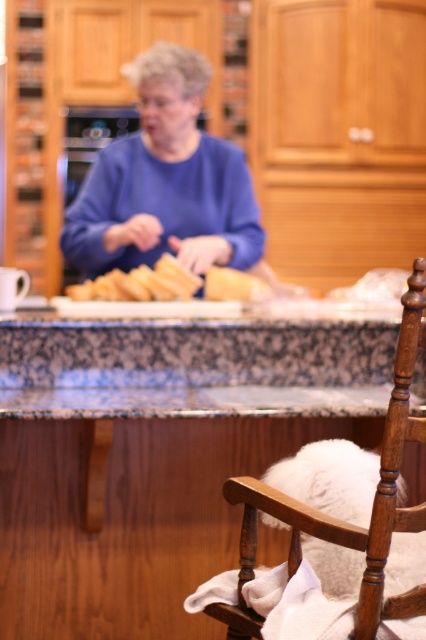
From the picture: Who is more forward, (186, 120) or (170, 260)?

Positioned in front is point (170, 260).

Who is more distant from viewer, (144, 109) or (120, 298)?

Positioned behind is point (144, 109).

Find the location of a particular element. blue matte sweater at center is located at coordinates (166, 180).

Between wooden rocking chair at lower right and golden brown bread at center, which one has more height?

Standing taller between the two is wooden rocking chair at lower right.

Between wooden rocking chair at lower right and golden brown bread at center, which one has less height?

golden brown bread at center

This screenshot has width=426, height=640. I want to click on wooden rocking chair at lower right, so (x=339, y=520).

Is blue matte sweater at center in front of wooden rocking chair at lower right?

No, blue matte sweater at center is behind wooden rocking chair at lower right.

Can you confirm if blue matte sweater at center is shorter than wooden rocking chair at lower right?

No.

Where is `blue matte sweater at center`? This screenshot has width=426, height=640. blue matte sweater at center is located at coordinates (166, 180).

You are a GUI agent. You are given a task and a screenshot of the screen. Output one action in this format:
    pyautogui.click(x=<x>, y=<y>)
    Task: Click on the blue matte sweater at center
    The height and width of the screenshot is (640, 426).
    Given the screenshot: What is the action you would take?
    (166, 180)